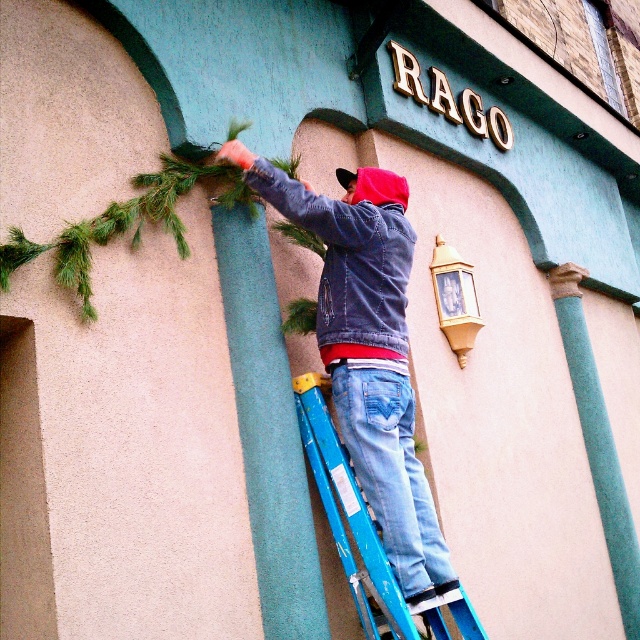
Question: Does denim jacket at center have a lesser width compared to blue metallic ladder at center?

Choices:
 (A) yes
 (B) no

Answer: (B)

Question: From the image, what is the correct spatial relationship of denim jacket at center in relation to blue metallic ladder at center?

Choices:
 (A) below
 (B) above

Answer: (B)

Question: Observing the image, what is the correct spatial positioning of denim jacket at center in reference to blue metallic ladder at center?

Choices:
 (A) below
 (B) above

Answer: (B)

Question: Which object appears farthest from the camera in this image?

Choices:
 (A) blue metallic ladder at center
 (B) denim jacket at center

Answer: (B)

Question: Among these points, which one is nearest to the camera?

Choices:
 (A) (x=358, y=225)
 (B) (x=365, y=612)

Answer: (B)